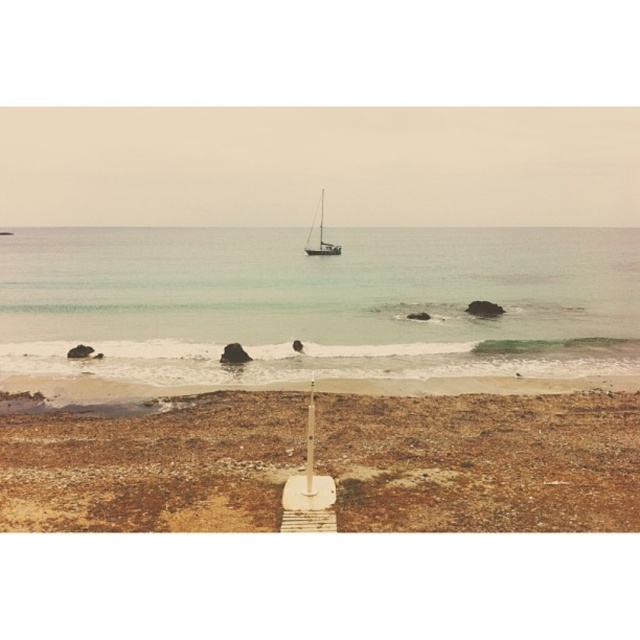
You are standing on the brown sandy beach at lower left and want to reach the clear water at center. Which direction should you move to get there?

You should move upward to reach the clear water at center since it is located above the brown sandy beach at lower left.